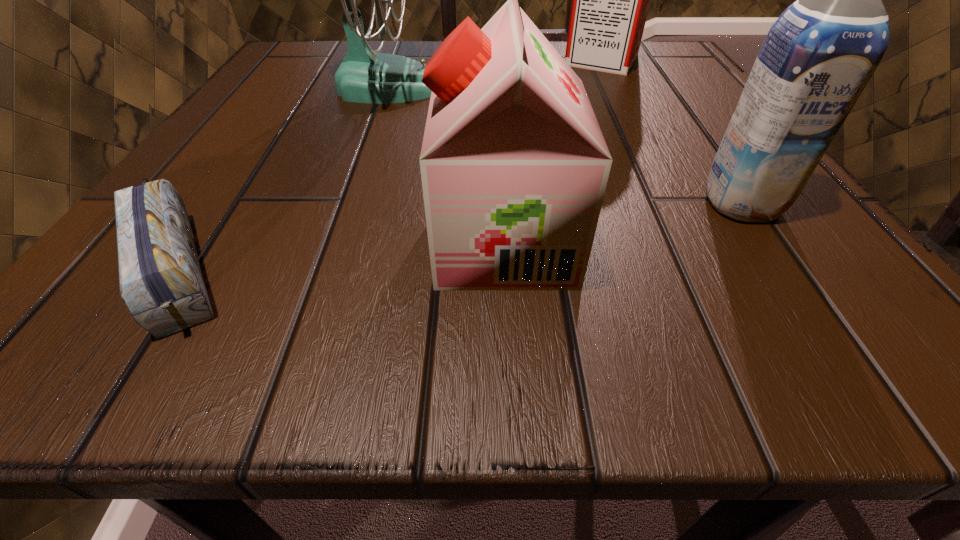
At what (x,y) coordinates should I click in order to perform the action: click on vacant region at the far edge of the desktop. Please return your answer as a coordinate pair (x, y). Looking at the image, I should click on (420, 50).

Where is `free location at the near edge of the desktop`? free location at the near edge of the desktop is located at coordinates (677, 312).

Where is `vacant area at the left edge of the desktop`? The width and height of the screenshot is (960, 540). vacant area at the left edge of the desktop is located at coordinates (223, 165).

In the image, there is a desktop. At what (x,y) coordinates should I click in order to perform the action: click on vacant space at the right edge. Please return your answer as a coordinate pair (x, y). Looking at the image, I should click on (674, 167).

Locate an element on the screen. This screenshot has width=960, height=540. vacant space at the far left corner is located at coordinates (276, 82).

In the image, there is a desktop. Where is `vacant space at the near left corner`? vacant space at the near left corner is located at coordinates (102, 353).

Where is `vacant space at the near right corner of the desktop`? Image resolution: width=960 pixels, height=540 pixels. vacant space at the near right corner of the desktop is located at coordinates (739, 298).

Locate an element on the screen. The height and width of the screenshot is (540, 960). vacant point located between the shortest object and the fan is located at coordinates (280, 174).

You are a GUI agent. You are given a task and a screenshot of the screen. Output one action in this format:
    pyautogui.click(x=<x>, y=<y>)
    Task: Click on the object that ranks as the closest to the shortest object
    The width and height of the screenshot is (960, 540).
    Given the screenshot: What is the action you would take?
    pyautogui.click(x=364, y=76)

Locate an element on the screen. Image resolution: width=960 pixels, height=540 pixels. object that is the third nearest to the farthest soya milk is located at coordinates (514, 166).